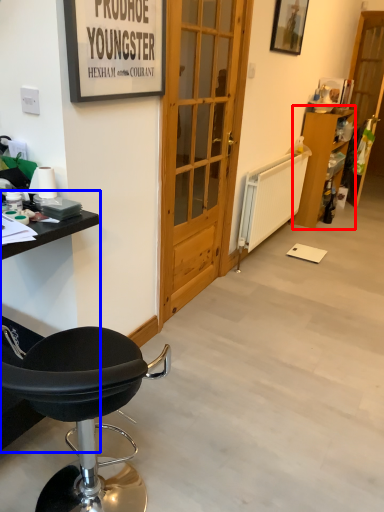
Question: Among these objects, which one is farthest to the camera, cabinetry (highlighted by a red box) or table (highlighted by a blue box)?

Choices:
 (A) cabinetry
 (B) table

Answer: (A)